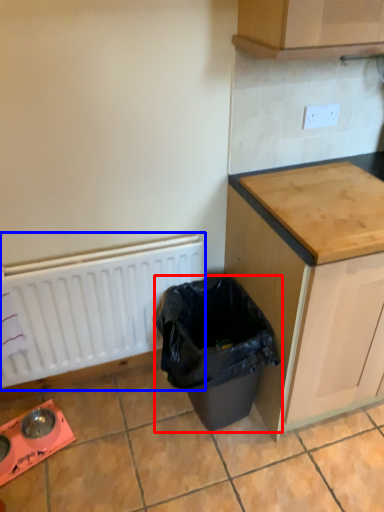
Question: Which point is closer to the camera, waste container (highlighted by a red box) or radiator (highlighted by a blue box)?

Choices:
 (A) waste container
 (B) radiator

Answer: (A)